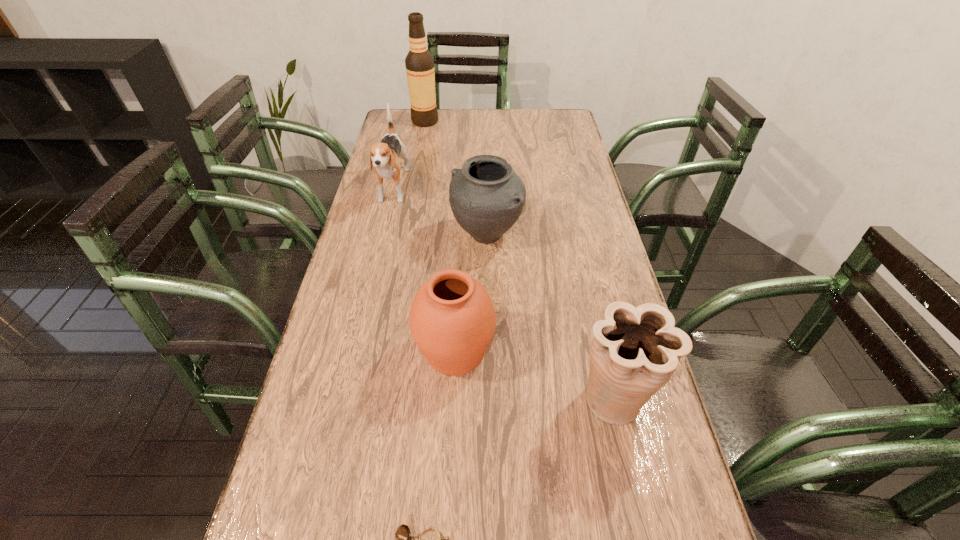
Find the location of a particular element. This screenshot has height=540, width=960. alcohol is located at coordinates (419, 63).

This screenshot has width=960, height=540. I want to click on the farthest object, so click(419, 63).

The image size is (960, 540). I want to click on puppy, so point(384,157).

Where is `the farthest urn`? Image resolution: width=960 pixels, height=540 pixels. the farthest urn is located at coordinates (486, 196).

Image resolution: width=960 pixels, height=540 pixels. I want to click on the rightmost object, so click(x=635, y=350).

I want to click on free spot located on the label of the tallest object, so click(x=483, y=122).

This screenshot has height=540, width=960. What are the coordinates of `vacant area situated 0.250m at the face of the puppy` in the screenshot? It's located at (373, 273).

At what (x,y) coordinates should I click in order to perform the action: click on vacant area located 0.080m on the left of the farthest urn. Please return your answer as a coordinate pair (x, y). The height and width of the screenshot is (540, 960). Looking at the image, I should click on (424, 235).

The image size is (960, 540). I want to click on vacant region located on the back of the rightmost urn, so click(x=587, y=278).

The image size is (960, 540). Identify the location of object that is at the far edge. (419, 63).